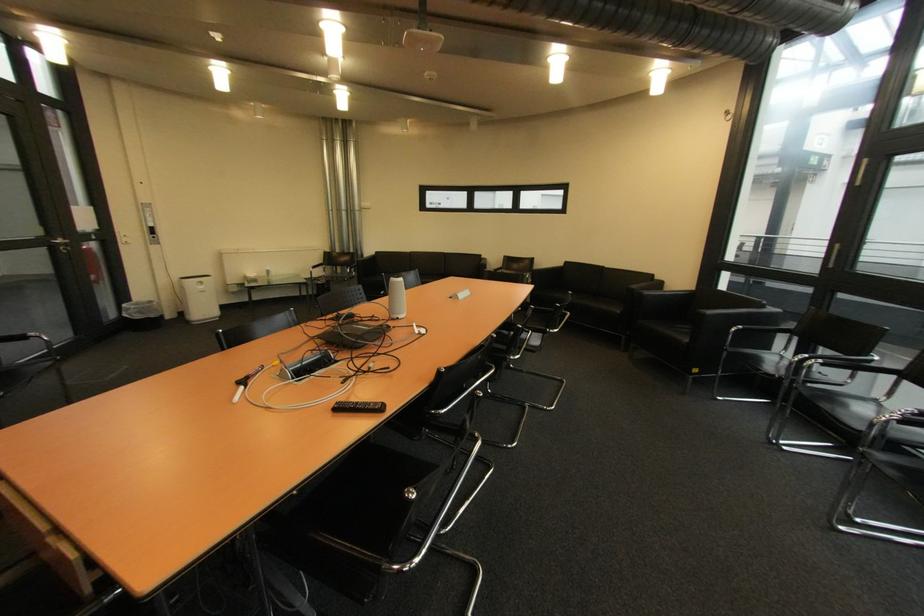
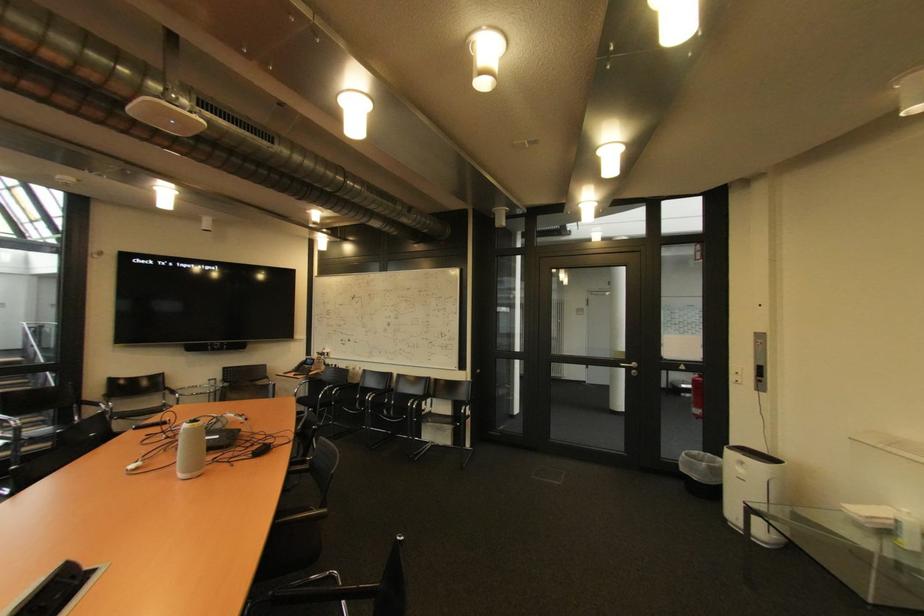
The point at (x=147, y=318) is marked in the first image. Where is the corresponding point in the second image?

(690, 471)